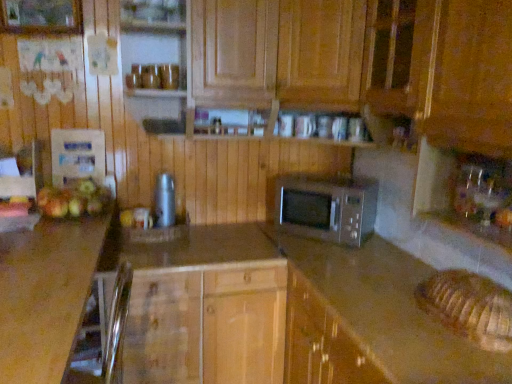
Question: From the image's perspective, is brushed metal thermos at center on top of wooden cabinet at center?

Choices:
 (A) no
 (B) yes

Answer: (B)

Question: Is brushed metal thermos at center at the left side of wooden cabinet at center?

Choices:
 (A) yes
 (B) no

Answer: (A)

Question: Is brushed metal thermos at center completely or partially outside of wooden cabinet at center?

Choices:
 (A) yes
 (B) no

Answer: (A)

Question: Does brushed metal thermos at center touch wooden cabinet at center?

Choices:
 (A) no
 (B) yes

Answer: (A)

Question: Is brushed metal thermos at center further to camera compared to wooden cabinet at center?

Choices:
 (A) no
 (B) yes

Answer: (B)

Question: Is there a large distance between brushed metal thermos at center and wooden cabinet at center?

Choices:
 (A) no
 (B) yes

Answer: (A)

Question: Considering the relative positions of brown laminate countertop at lower left, placed as the first countertop when sorted from left to right, and smooth granite countertop at center, which is counted as the second countertop, starting from the left, in the image provided, is brown laminate countertop at lower left, placed as the first countertop when sorted from left to right, to the left of smooth granite countertop at center, which is counted as the second countertop, starting from the left, from the viewer's perspective?

Choices:
 (A) yes
 (B) no

Answer: (A)

Question: Is brown laminate countertop at lower left, placed as the first countertop when sorted from left to right, positioned beyond the bounds of smooth granite countertop at center, which is counted as the second countertop, starting from the left?

Choices:
 (A) no
 (B) yes

Answer: (B)

Question: From the image's perspective, is brown laminate countertop at lower left, placed as the first countertop when sorted from left to right, located above smooth granite countertop at center, which is counted as the second countertop, starting from the left?

Choices:
 (A) no
 (B) yes

Answer: (B)

Question: Is brown laminate countertop at lower left, placed as the first countertop when sorted from left to right, thinner than smooth granite countertop at center, which is counted as the second countertop, starting from the left?

Choices:
 (A) yes
 (B) no

Answer: (B)

Question: From a real-world perspective, does brown laminate countertop at lower left, acting as the second countertop starting from the right, stand above smooth granite countertop at center, which is counted as the second countertop, starting from the left?

Choices:
 (A) no
 (B) yes

Answer: (B)

Question: Considering the relative sizes of brown laminate countertop at lower left, placed as the first countertop when sorted from left to right, and smooth granite countertop at center, which is counted as the second countertop, starting from the left, in the image provided, is brown laminate countertop at lower left, placed as the first countertop when sorted from left to right, shorter than smooth granite countertop at center, which is counted as the second countertop, starting from the left,?

Choices:
 (A) no
 (B) yes

Answer: (A)

Question: Considering the relative sizes of wooden cabinet at center and green matte apple at left, the second apple in the front-to-back sequence, in the image provided, is wooden cabinet at center thinner than green matte apple at left, the second apple in the front-to-back sequence,?

Choices:
 (A) yes
 (B) no

Answer: (B)